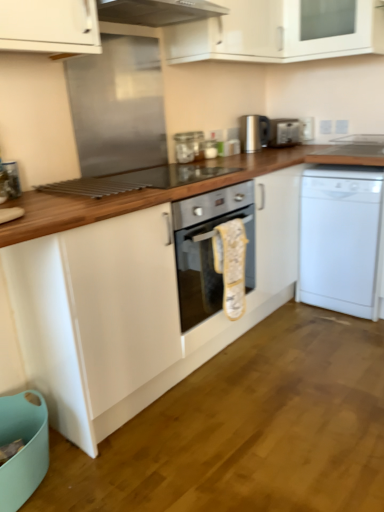
Image resolution: width=384 pixels, height=512 pixels. I want to click on white matte dishwasher at right, so click(341, 239).

Image resolution: width=384 pixels, height=512 pixels. What do you see at coordinates (254, 132) in the screenshot?
I see `satin silver kettle at upper center, the 2th appliance positioned from the right` at bounding box center [254, 132].

Locate an element on the screen. This screenshot has width=384, height=512. satin silver toaster at upper right, which is counted as the 1th appliance, starting from the right is located at coordinates click(285, 132).

Locate an element on the screen. The height and width of the screenshot is (512, 384). wooden at center is located at coordinates (135, 295).

In the scene shown: In order to face white glossy cabinet at upper center, the second cabinetry positioned from the right, should I rotate leftwards or rightwards?

A 11.893 degree turn to the right will do.

Locate an element on the screen. white matte dishwasher at right is located at coordinates (341, 239).

Where is `the 1st appliance below the white glossy cabinet at upper center, the second cabinetry positioned from the right (from a real-world perspective)`? The image size is (384, 512). the 1st appliance below the white glossy cabinet at upper center, the second cabinetry positioned from the right (from a real-world perspective) is located at coordinates (254, 132).

Does point (181, 62) appear closer or farther from the camera than point (261, 141)?

Point (181, 62) appears to be closer to the viewer than point (261, 141).

Can you confirm if white glossy cabinet at upper center, which ranks as the first cabinetry in left-to-right order, is positioned to the right of satin silver kettle at upper center, the first appliance in the left-to-right sequence?

Correct, you'll find white glossy cabinet at upper center, which ranks as the first cabinetry in left-to-right order, to the right of satin silver kettle at upper center, the first appliance in the left-to-right sequence.

Who is smaller, white glossy cabinet at upper center, which ranks as the first cabinetry in left-to-right order, or satin silver kettle at upper center, the 2th appliance positioned from the right?

satin silver kettle at upper center, the 2th appliance positioned from the right.

Is satin silver toaster at upper right, which is counted as the 1th appliance, starting from the right, located outside white matte dishwasher at right?

That's correct, satin silver toaster at upper right, which is counted as the 1th appliance, starting from the right, is outside of white matte dishwasher at right.

Would you consider satin silver toaster at upper right, marked as the second appliance in a left-to-right arrangement, to be distant from white matte dishwasher at right?

No, satin silver toaster at upper right, marked as the second appliance in a left-to-right arrangement, is not far away from white matte dishwasher at right.

Does satin silver toaster at upper right, marked as the second appliance in a left-to-right arrangement, have a smaller size compared to white matte dishwasher at right?

Yes, satin silver toaster at upper right, marked as the second appliance in a left-to-right arrangement, is smaller than white matte dishwasher at right.

Is the depth of satin silver toaster at upper right, which is counted as the 1th appliance, starting from the right, less than that of white matte dishwasher at right?

No.

From a real-world perspective, which is physically above, satin silver toaster at upper right, marked as the second appliance in a left-to-right arrangement, or white glossy cabinet at upper center, placed as the 1th cabinetry when sorted from right to left?

In real-world perspective, white glossy cabinet at upper center, placed as the 1th cabinetry when sorted from right to left, is above.

How many degrees apart are the facing directions of satin silver toaster at upper right, marked as the second appliance in a left-to-right arrangement, and white glossy cabinet at upper center, placed as the 1th cabinetry when sorted from right to left?

55.6 degrees.

In terms of size, does satin silver toaster at upper right, which is counted as the 1th appliance, starting from the right, appear bigger or smaller than white glossy cabinet at upper center, placed as the 1th cabinetry when sorted from right to left?

Clearly, satin silver toaster at upper right, which is counted as the 1th appliance, starting from the right, is smaller in size than white glossy cabinet at upper center, placed as the 1th cabinetry when sorted from right to left.

Which of these two, satin silver toaster at upper right, marked as the second appliance in a left-to-right arrangement, or white glossy cabinet at upper center, which appears as the 2th cabinetry when viewed from the left, stands shorter?

With less height is satin silver toaster at upper right, marked as the second appliance in a left-to-right arrangement.

Who is shorter, white glossy cabinet at upper center, the second cabinetry positioned from the right, or white matte dishwasher at right?

white glossy cabinet at upper center, the second cabinetry positioned from the right, is shorter.

Who is smaller, white glossy cabinet at upper center, the second cabinetry positioned from the right, or white matte dishwasher at right?

white matte dishwasher at right is smaller.

Visually, is white glossy cabinet at upper center, the second cabinetry positioned from the right, positioned to the left or to the right of white matte dishwasher at right?

white glossy cabinet at upper center, the second cabinetry positioned from the right, is positioned on white matte dishwasher at right's left side.

Is white glossy cabinet at upper center, which appears as the 2th cabinetry when viewed from the left, positioned beyond the bounds of satin silver kettle at upper center, the 2th appliance positioned from the right?

white glossy cabinet at upper center, which appears as the 2th cabinetry when viewed from the left, lies outside satin silver kettle at upper center, the 2th appliance positioned from the right,'s area.

From the image's perspective, is white glossy cabinet at upper center, which appears as the 2th cabinetry when viewed from the left, located beneath satin silver kettle at upper center, the 2th appliance positioned from the right?

No, from the image's perspective, white glossy cabinet at upper center, which appears as the 2th cabinetry when viewed from the left, is not beneath satin silver kettle at upper center, the 2th appliance positioned from the right.

How much distance is there between white glossy cabinet at upper center, which appears as the 2th cabinetry when viewed from the left, and satin silver kettle at upper center, the first appliance in the left-to-right sequence?

white glossy cabinet at upper center, which appears as the 2th cabinetry when viewed from the left, is 61.63 centimeters away from satin silver kettle at upper center, the first appliance in the left-to-right sequence.

Is white glossy cabinet at upper center, which appears as the 2th cabinetry when viewed from the left, oriented away from satin silver kettle at upper center, the first appliance in the left-to-right sequence?

white glossy cabinet at upper center, which appears as the 2th cabinetry when viewed from the left, does not have its back to satin silver kettle at upper center, the first appliance in the left-to-right sequence.

Considering the sizes of white matte dishwasher at right and white glossy cabinet at upper center, the second cabinetry positioned from the right, in the image, is white matte dishwasher at right taller or shorter than white glossy cabinet at upper center, the second cabinetry positioned from the right,?

Clearly, white matte dishwasher at right is taller compared to white glossy cabinet at upper center, the second cabinetry positioned from the right.

Is white matte dishwasher at right looking in the opposite direction of white glossy cabinet at upper center, which ranks as the first cabinetry in left-to-right order?

That's not correct — white matte dishwasher at right is not looking away from white glossy cabinet at upper center, which ranks as the first cabinetry in left-to-right order.

What's the angular difference between white matte dishwasher at right and white glossy cabinet at upper center, the second cabinetry positioned from the right,'s facing directions?

The angular difference between white matte dishwasher at right and white glossy cabinet at upper center, the second cabinetry positioned from the right, is 0.182 degrees.

Is point (346, 190) less distant than point (308, 1)?

Yes, point (346, 190) is closer to viewer.

Which is more to the left, white matte dishwasher at right or satin silver toaster at upper right, which is counted as the 1th appliance, starting from the right?

satin silver toaster at upper right, which is counted as the 1th appliance, starting from the right.

Looking at this image, does white matte dishwasher at right have a lesser width compared to satin silver toaster at upper right, marked as the second appliance in a left-to-right arrangement?

Incorrect, the width of white matte dishwasher at right is not less than that of satin silver toaster at upper right, marked as the second appliance in a left-to-right arrangement.

Is white matte dishwasher at right smaller than satin silver toaster at upper right, marked as the second appliance in a left-to-right arrangement?

No, white matte dishwasher at right is not smaller than satin silver toaster at upper right, marked as the second appliance in a left-to-right arrangement.

Where is `appliance that is the 1st one when counting leftward from the white matte dishwasher at right`? appliance that is the 1st one when counting leftward from the white matte dishwasher at right is located at coordinates (285, 132).

Where is `the 1st cabinetry above when counting from the satin silver kettle at upper center, the first appliance in the left-to-right sequence (from the image's perspective)`? the 1st cabinetry above when counting from the satin silver kettle at upper center, the first appliance in the left-to-right sequence (from the image's perspective) is located at coordinates (278, 32).

Starting from the white matte dishwasher at right, which appliance is the 1st one to the left? Please provide its 2D coordinates.

[(285, 132)]

Estimate the real-world distances between objects in this image. Which object is closer to wooden at center, satin silver kettle at upper center, the first appliance in the left-to-right sequence, or satin silver toaster at upper right, which is counted as the 1th appliance, starting from the right?

satin silver kettle at upper center, the first appliance in the left-to-right sequence.

Estimate the real-world distances between objects in this image. Which object is further from white glossy cabinet at upper center, placed as the 1th cabinetry when sorted from right to left, white matte dishwasher at right or satin silver toaster at upper right, marked as the second appliance in a left-to-right arrangement?

white matte dishwasher at right is positioned further to the anchor white glossy cabinet at upper center, placed as the 1th cabinetry when sorted from right to left.

Looking at this image, which object lies further to the anchor point wooden at center, white glossy cabinet at upper center, the second cabinetry positioned from the right, or white glossy cabinet at upper center, placed as the 1th cabinetry when sorted from right to left?

white glossy cabinet at upper center, placed as the 1th cabinetry when sorted from right to left, lies further to wooden at center than the other object.

When comparing their distances from white matte dishwasher at right, does white glossy cabinet at upper center, which ranks as the first cabinetry in left-to-right order, or satin silver toaster at upper right, marked as the second appliance in a left-to-right arrangement, seem closer?

satin silver toaster at upper right, marked as the second appliance in a left-to-right arrangement, is closer to white matte dishwasher at right.

Considering their positions, is wooden at center positioned closer to satin silver kettle at upper center, the 2th appliance positioned from the right, than white glossy cabinet at upper center, placed as the 1th cabinetry when sorted from right to left?

Based on the image, white glossy cabinet at upper center, placed as the 1th cabinetry when sorted from right to left, appears to be nearer to satin silver kettle at upper center, the 2th appliance positioned from the right.

When comparing their distances from satin silver toaster at upper right, marked as the second appliance in a left-to-right arrangement, does white glossy cabinet at upper center, placed as the 1th cabinetry when sorted from right to left, or white glossy cabinet at upper center, which ranks as the first cabinetry in left-to-right order, seem further?

white glossy cabinet at upper center, which ranks as the first cabinetry in left-to-right order, is further to satin silver toaster at upper right, marked as the second appliance in a left-to-right arrangement.

Looking at the image, which one is located further to satin silver kettle at upper center, the first appliance in the left-to-right sequence, wooden at center or white glossy cabinet at upper center, the second cabinetry positioned from the right?

wooden at center is further to satin silver kettle at upper center, the first appliance in the left-to-right sequence.

From the picture: Estimate the real-world distances between objects in this image. Which object is further from white glossy cabinet at upper center, which ranks as the first cabinetry in left-to-right order, wooden at center or white matte dishwasher at right?

wooden at center is positioned further to the anchor white glossy cabinet at upper center, which ranks as the first cabinetry in left-to-right order.

This screenshot has height=512, width=384. I want to click on appliance between satin silver toaster at upper right, marked as the second appliance in a left-to-right arrangement, and white matte dishwasher at right in the up-down direction, so click(x=254, y=132).

I want to click on cabinetry between wooden at center and white matte dishwasher at right from front to back, so click(x=278, y=32).

Identify the location of cabinetry located between white glossy cabinet at upper center, the second cabinetry positioned from the right, and satin silver kettle at upper center, the first appliance in the left-to-right sequence, in the depth direction. The width and height of the screenshot is (384, 512). (332, 28).

Where is `dishwasher located between wooden at center and satin silver kettle at upper center, the 2th appliance positioned from the right, in the depth direction`? This screenshot has width=384, height=512. dishwasher located between wooden at center and satin silver kettle at upper center, the 2th appliance positioned from the right, in the depth direction is located at coordinates pyautogui.click(x=341, y=239).